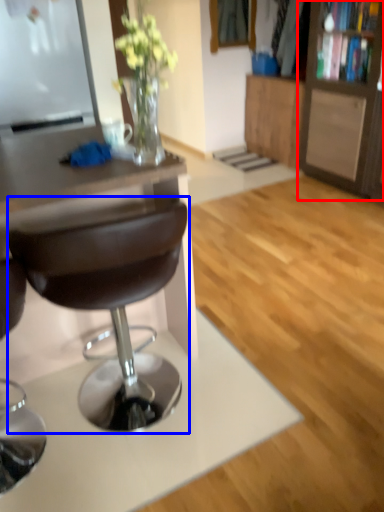
Question: Which point is further to the camera, cabinetry (highlighted by a red box) or chair (highlighted by a blue box)?

Choices:
 (A) cabinetry
 (B) chair

Answer: (A)